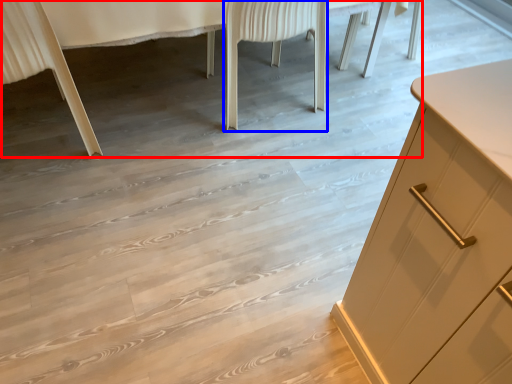
Question: Which object is closer to the camera taking this photo, vanity (highlighted by a red box) or chair (highlighted by a blue box)?

Choices:
 (A) vanity
 (B) chair

Answer: (A)